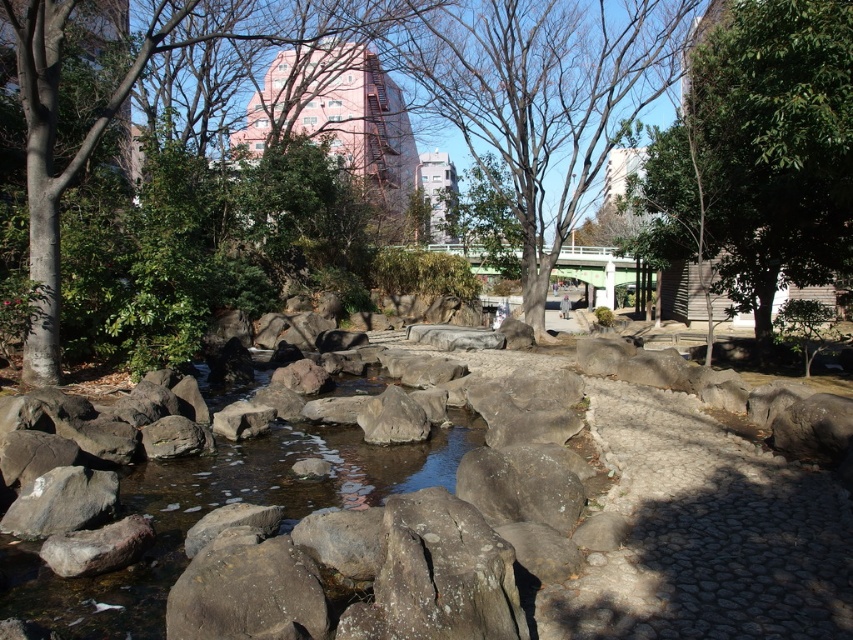
How distant is bare wood tree at center from green leafy tree at upper left?

The distance of bare wood tree at center from green leafy tree at upper left is 5.02 meters.

Is point (477, 113) behind point (65, 20)?

Yes.

Image resolution: width=853 pixels, height=640 pixels. What are the coordinates of `bare wood tree at center` in the screenshot? It's located at (543, 99).

Between green leafy tree at center and green leafy tree at upper left, which one appears on the right side from the viewer's perspective?

green leafy tree at center

Locate an element on the screen. This screenshot has width=853, height=640. green leafy tree at center is located at coordinates (759, 154).

Consider the image. Can you confirm if green leafy tree at center is positioned below bare wood tree at center?

Yes.

Which is more to the right, green leafy tree at center or bare wood tree at center?

A: green leafy tree at center is more to the right.

Is point (811, 67) closer to camera compared to point (583, 132)?

Yes, point (811, 67) is in front of point (583, 132).

Where is `green leafy tree at center`? The height and width of the screenshot is (640, 853). green leafy tree at center is located at coordinates (759, 154).